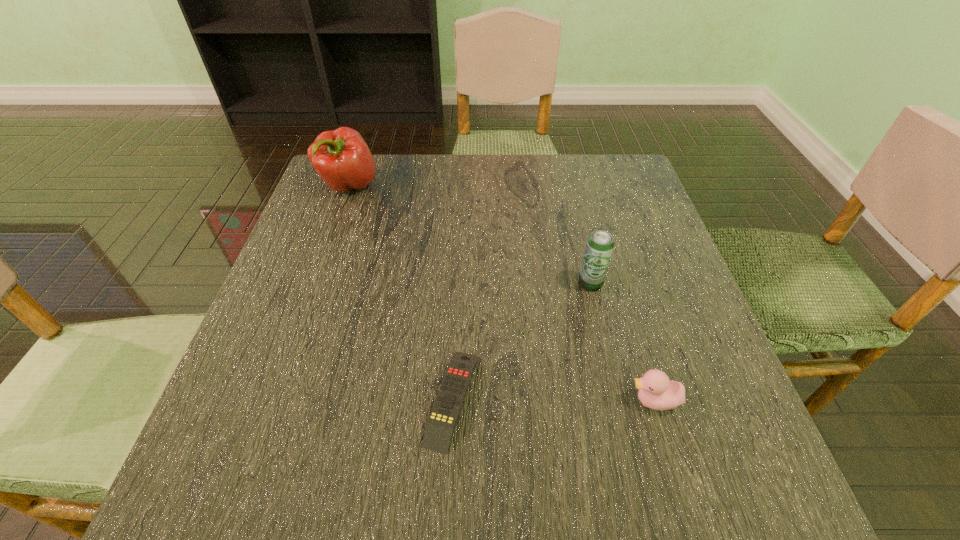
This screenshot has height=540, width=960. In order to click on vacant space at the left edge in this screenshot , I will do `click(348, 269)`.

At what (x,y) coordinates should I click in order to perform the action: click on free spot at the right edge of the desktop. Please return your answer as a coordinate pair (x, y). The image size is (960, 540). Looking at the image, I should click on (628, 334).

The image size is (960, 540). In order to click on free space at the near left corner of the desktop in this screenshot , I will do `click(273, 469)`.

You are a GUI agent. You are given a task and a screenshot of the screen. Output one action in this format:
    pyautogui.click(x=<x>, y=<y>)
    Task: Click on the vacant space at the far right corner
    This screenshot has height=540, width=960.
    Given the screenshot: What is the action you would take?
    pyautogui.click(x=636, y=206)

In order to click on vacant space that's between the remote control and the third tallest object in this screenshot , I will do `click(553, 400)`.

The image size is (960, 540). Identify the location of free point between the second object from left to right and the second tallest object. (521, 341).

You are a GUI agent. You are given a task and a screenshot of the screen. Output one action in this format:
    pyautogui.click(x=<x>, y=<y>)
    Task: Click on the vacant area that lies between the third shortest object and the duckling
    The height and width of the screenshot is (540, 960).
    Given the screenshot: What is the action you would take?
    pyautogui.click(x=622, y=342)

At what (x,y) coordinates should I click in order to perform the action: click on free space between the second tallest object and the remote control. Please return your answer as a coordinate pair (x, y). This screenshot has height=540, width=960. Looking at the image, I should click on (521, 341).

Where is `unoccupied position between the leftmost object and the remote control`? unoccupied position between the leftmost object and the remote control is located at coordinates (400, 292).

Locate an element on the screen. free space between the third tallest object and the tallest object is located at coordinates (x=501, y=293).